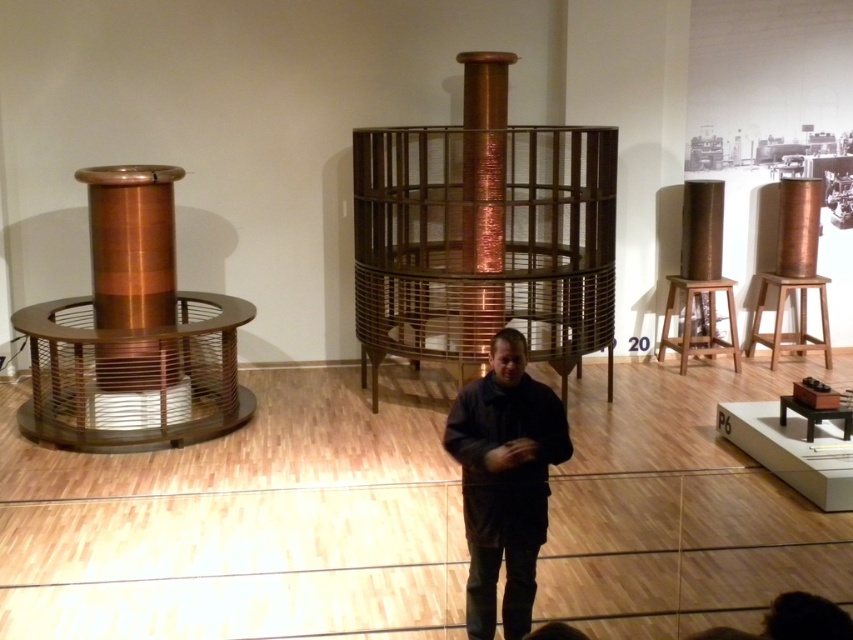
Question: Which object is closer to the camera taking this photo?

Choices:
 (A) light brown wooden stool at right
 (B) dark matte jacket at center
 (C) wooden stool at right

Answer: (B)

Question: From the image, what is the correct spatial relationship of light brown wooden stool at right in relation to wooden stool at right?

Choices:
 (A) right
 (B) left

Answer: (B)

Question: Is dark matte jacket at center smaller than light brown wooden stool at right?

Choices:
 (A) yes
 (B) no

Answer: (A)

Question: Estimate the real-world distances between objects in this image. Which object is farther from the wooden stool at right?

Choices:
 (A) light brown wooden stool at right
 (B) copper wire mesh cage at center
 (C) dark matte jacket at center

Answer: (C)

Question: Which object is the farthest from the light brown wooden stool at right?

Choices:
 (A) copper wire mesh cage at center
 (B) wooden stool at right

Answer: (A)

Question: Does dark matte jacket at center have a larger size compared to wooden stool at right?

Choices:
 (A) yes
 (B) no

Answer: (B)